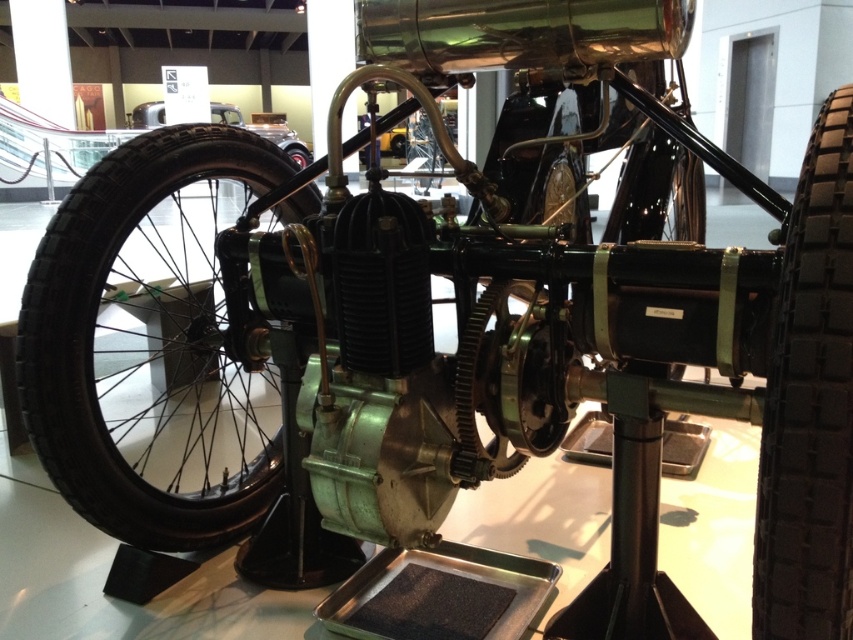
Does black rubber tire at left have a larger size compared to black rubber tire at right?

Indeed, black rubber tire at left has a larger size compared to black rubber tire at right.

Which is behind, point (155, 234) or point (810, 467)?

The point (155, 234) is more distant.

This screenshot has width=853, height=640. I want to click on black rubber tire at left, so click(151, 344).